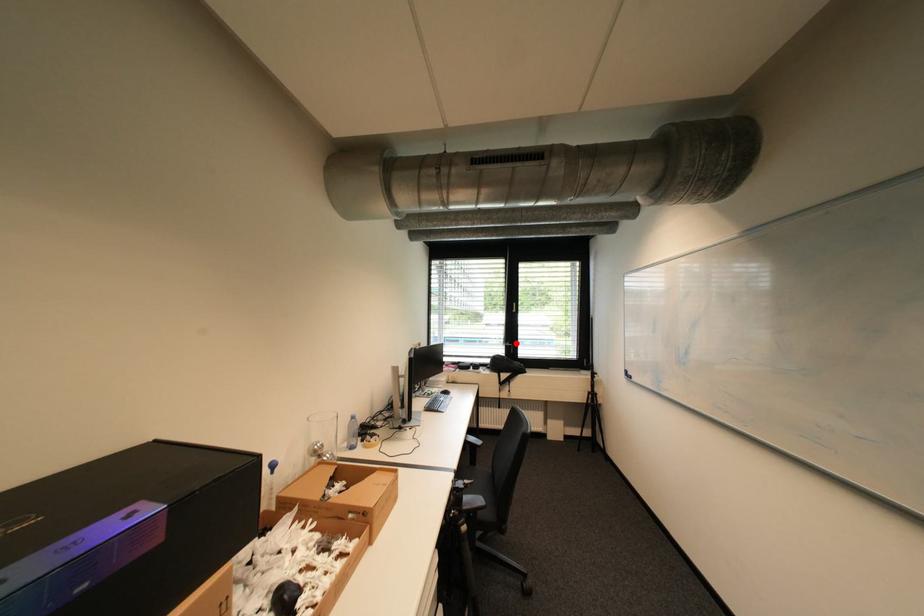
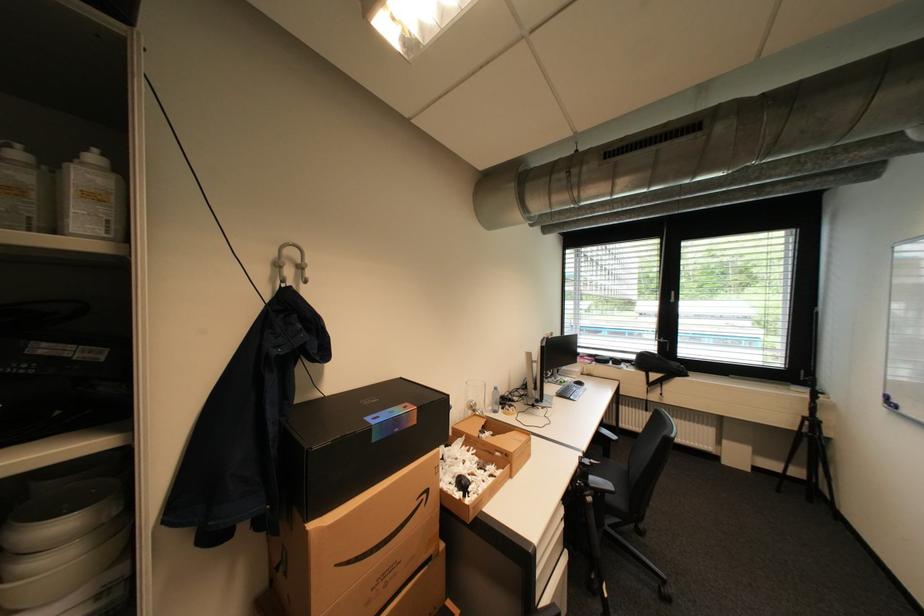
Question: I am providing you with two images of the same scene from different viewpoints. In image1, a red point is highlighted. Considering the same 3D point in image2, which of the following is correct?

Choices:
 (A) It is closer
 (B) It is farther

Answer: (A)